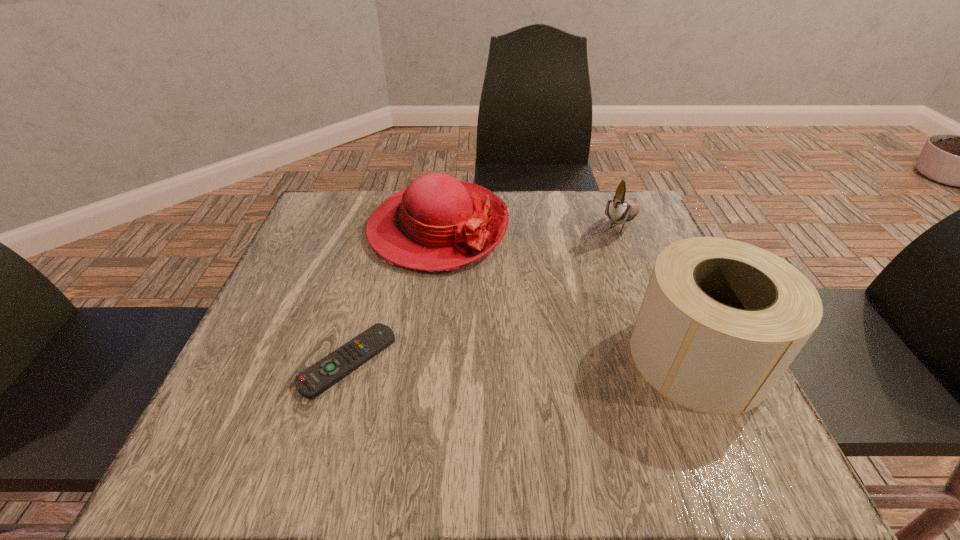
The image size is (960, 540). Find the location of `vacant region located 0.100m at the face of the bird`. vacant region located 0.100m at the face of the bird is located at coordinates (600, 268).

Locate an element on the screen. This screenshot has width=960, height=540. free location located at the face of the bird is located at coordinates (600, 268).

Find the location of a particular element. This screenshot has height=540, width=960. hat that is positioned at the far edge is located at coordinates (437, 223).

At what (x,y) coordinates should I click in order to perform the action: click on bird that is at the far edge. Please return your answer as a coordinate pair (x, y). Image resolution: width=960 pixels, height=540 pixels. Looking at the image, I should click on (619, 210).

Find the location of a particular element. remote control that is at the near edge is located at coordinates (316, 379).

At what (x,y) coordinates should I click in order to perform the action: click on toilet tissue that is positioned at the near edge. Please return your answer as a coordinate pair (x, y). Looking at the image, I should click on (721, 320).

What are the coordinates of `remote control located in the left edge section of the desktop` in the screenshot? It's located at (316, 379).

Locate an element on the screen. This screenshot has width=960, height=540. hat located at the left edge is located at coordinates (437, 223).

Find the location of `toilet tissue present at the right edge`. toilet tissue present at the right edge is located at coordinates (721, 320).

The height and width of the screenshot is (540, 960). What are the coordinates of `bird located in the right edge section of the desktop` in the screenshot? It's located at (619, 210).